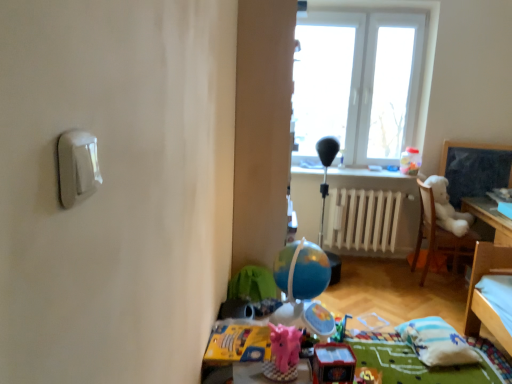
Question: From a real-world perspective, is white plush bear at right above or below white painted metal radiator at center?

Choices:
 (A) above
 (B) below

Answer: (A)

Question: Would you say white plush bear at right is to the left or to the right of white painted metal radiator at center in the picture?

Choices:
 (A) right
 (B) left

Answer: (A)

Question: Based on their relative distances, which object is nearer to the white plastic window at upper center?

Choices:
 (A) white plastic light switch at upper left
 (B) pink fabric stuffed animal at center, the second toy when ordered from bottom to top
 (C) white soft pillow at lower right
 (D) white plush bear at right
 (E) white painted metal radiator at center

Answer: (E)

Question: Estimate the real-world distances between objects in this image. Which object is farther from the white plastic light switch at upper left?

Choices:
 (A) pink fabric stuffed animal at center, marked as the 2th toy in a front-to-back arrangement
 (B) white soft pillow at lower right
 (C) white plastic window at upper center
 (D) rubber red toy car at lower center, arranged as the 3th toy when viewed from the back
 (E) white painted metal radiator at center

Answer: (C)